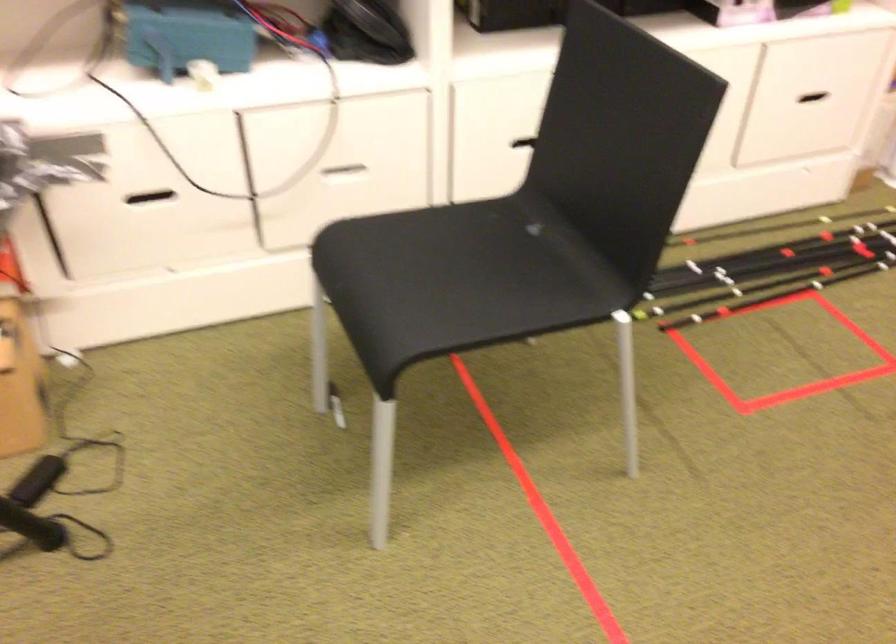
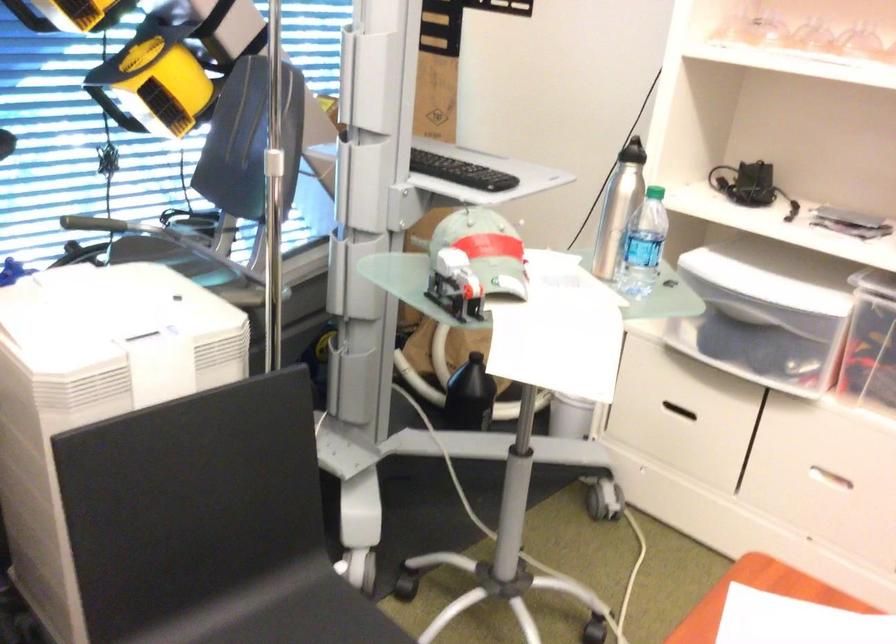
Question: The camera is either moving clockwise (left) or counter-clockwise (right) around the object. The first image is from the beginning of the video and the second image is from the end. Is the camera moving left or right when shooting the video?

Choices:
 (A) Left
 (B) Right

Answer: (B)